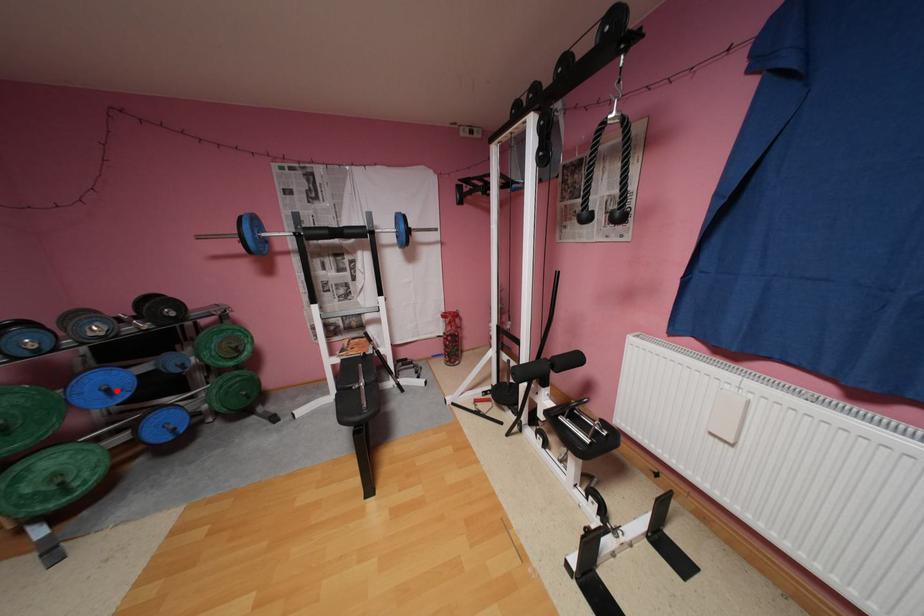
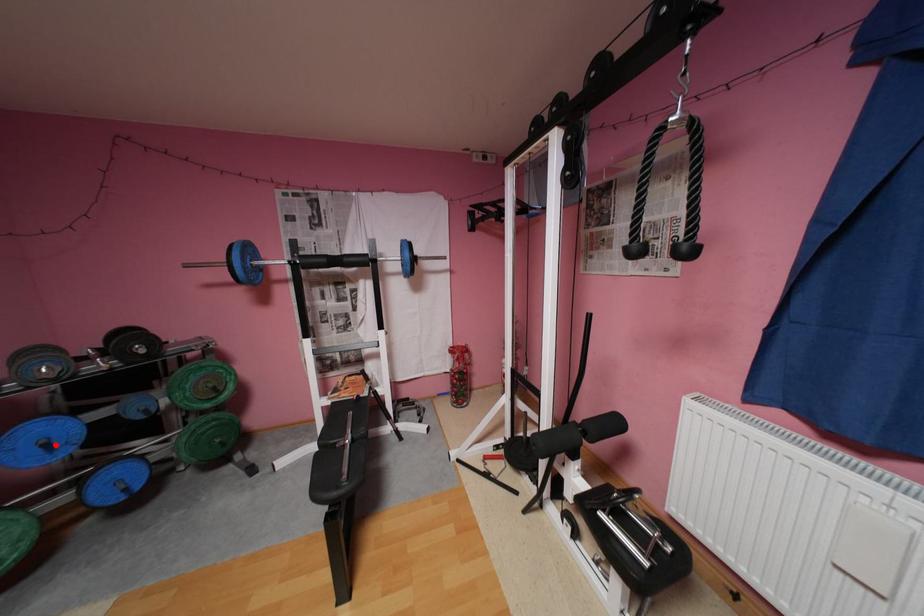
I am providing you with two images of the same scene from different viewpoints. A red point is marked on the first image and another point is marked on the second image. Is the red point in image1 aligned with the point shown in image2?

Yes